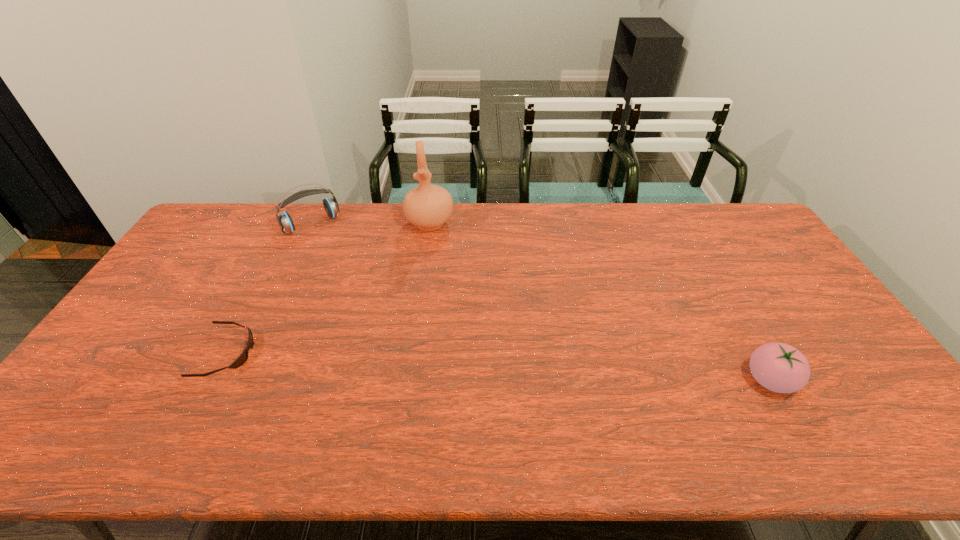
This screenshot has width=960, height=540. In order to click on free space between the rightmost object and the headset in this screenshot , I will do `click(540, 302)`.

Identify which object is the third nearest to the shortest object. Please provide its 2D coordinates. Your answer should be formatted as a tuple, i.e. [(x, y)], where the tuple contains the x and y coordinates of a point satisfying the conditions above.

[(779, 367)]

Identify which object is located as the third nearest to the third tallest object. Please provide its 2D coordinates. Your answer should be formatted as a tuple, i.e. [(x, y)], where the tuple contains the x and y coordinates of a point satisfying the conditions above.

[(331, 206)]

Locate an element on the screen. vacant space that satisfies the following two spatial constraints: 1. on the front side of the tomato; 2. on the right side of the pottery is located at coordinates (408, 380).